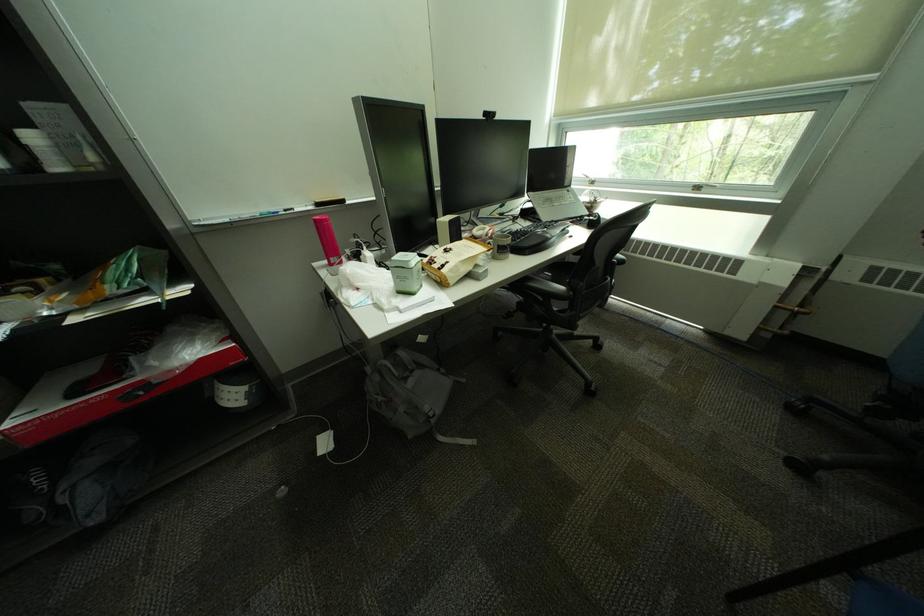
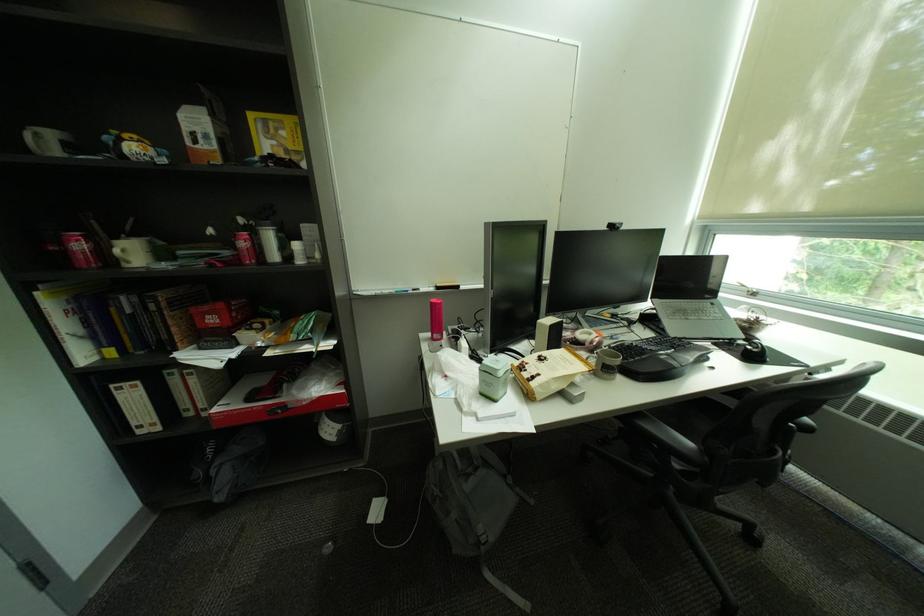
Locate, in the second image, the point that corresponds to the point at 388,395 in the first image.

(446, 487)